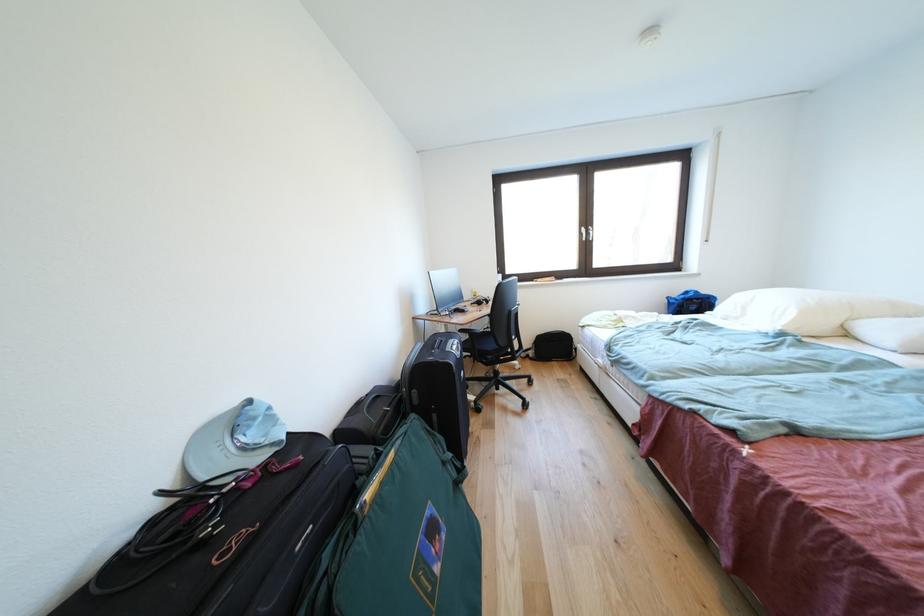
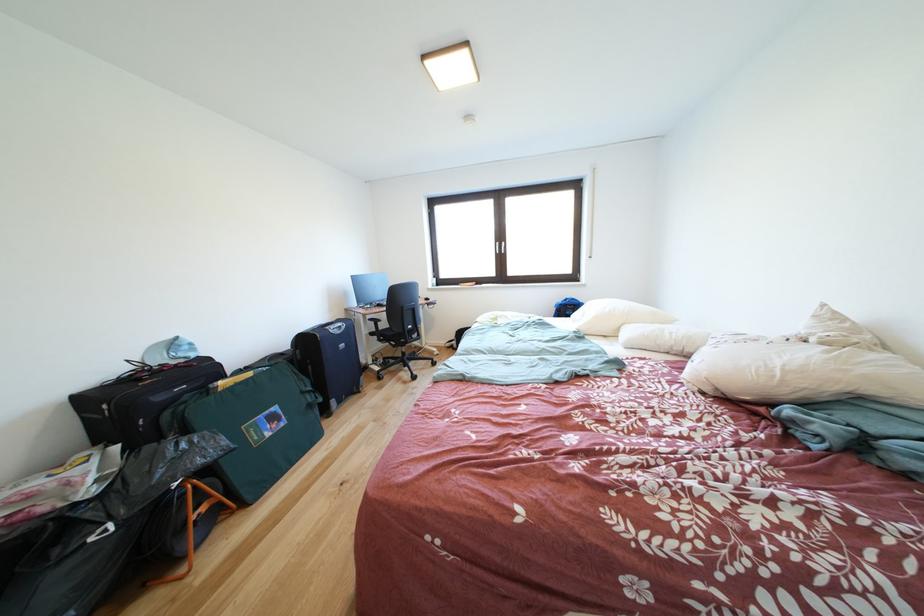
Where in the second image is the point corresponding to pixel 706 304 from the first image?

(578, 310)